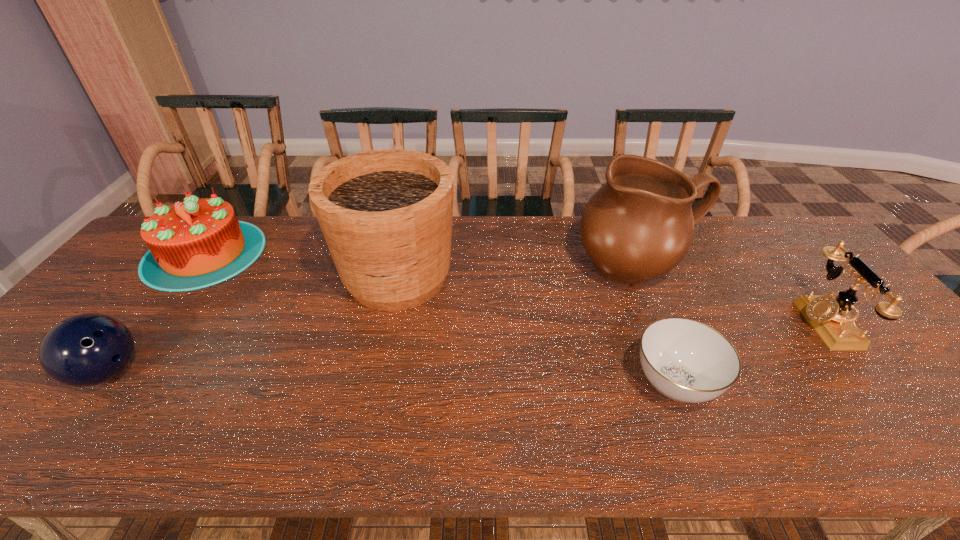
The height and width of the screenshot is (540, 960). Identify the location of object that is at the right edge. (831, 318).

The width and height of the screenshot is (960, 540). In order to click on object that is at the far left corner in this screenshot , I will do `click(197, 243)`.

Where is `vacant space at the far edge of the desktop`? vacant space at the far edge of the desktop is located at coordinates (270, 241).

This screenshot has height=540, width=960. In the image, there is a desktop. In order to click on free space at the near edge in this screenshot , I will do `click(919, 443)`.

At what (x,y) coordinates should I click in order to perform the action: click on free region at the left edge. Please return your answer as a coordinate pair (x, y). Looking at the image, I should click on (20, 401).

The image size is (960, 540). In the image, there is a desktop. Find the location of `free space at the far right corner`. free space at the far right corner is located at coordinates (766, 238).

Where is `vacant point located between the bowling ball and the shortest object`? Image resolution: width=960 pixels, height=540 pixels. vacant point located between the bowling ball and the shortest object is located at coordinates (392, 377).

The image size is (960, 540). In order to click on vacant area between the cream pitcher and the bowling ball in this screenshot , I will do `click(373, 320)`.

At what (x,y) coordinates should I click in order to perform the action: click on free space between the rightmost object and the cream pitcher. Please return your answer as a coordinate pair (x, y). The height and width of the screenshot is (540, 960). Looking at the image, I should click on (732, 295).

Image resolution: width=960 pixels, height=540 pixels. Identify the location of empty space between the shortest object and the cake. (440, 318).